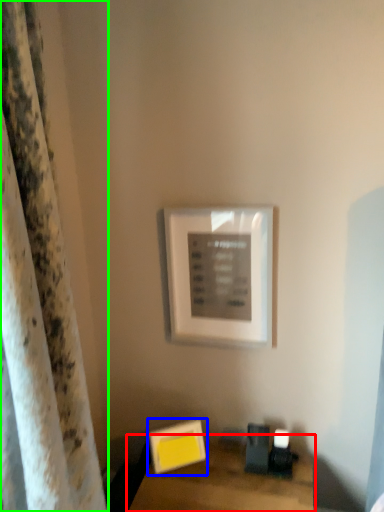
Question: Estimate the real-world distances between objects in this image. Which object is closer to table (highlighted by a red box), picture frame (highlighted by a blue box) or curtain (highlighted by a green box)?

Choices:
 (A) picture frame
 (B) curtain

Answer: (A)